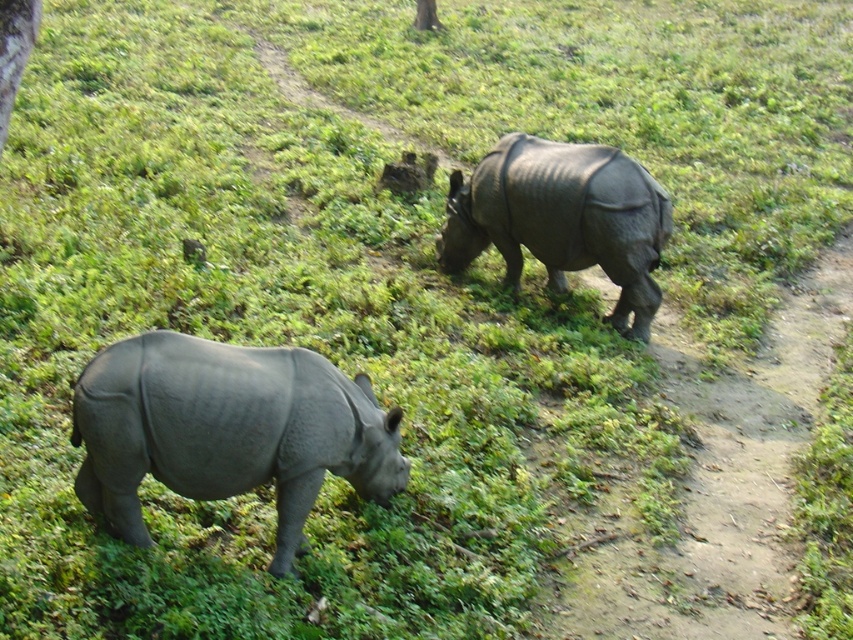
You are a wildlife photographer aiming to capture a photo of both rhinoceroses in the same frame. Given their positions, which direction should you move to ensure both the gray matte rhinoceros at lower left and the gray matte rhinoceros at upper right are visible in your camera viewfinder?

You should move to the center of the frame between the gray matte rhinoceros at lower left and the gray matte rhinoceros at upper right to ensure both are visible in the camera viewfinder since they are positioned to the left and right respectively.

You are a wildlife photographer trying to capture a photo of the gray matte rhinoceros at upper right. You are currently standing next to the gray matte rhinoceros at lower left. Which direction should you move to get a clear shot of the upper rhino?

The gray matte rhinoceros at upper right is above the gray matte rhinoceros at lower left, so you should move upward or to the right to get a clear shot of the gray matte rhinoceros at upper right.

You are standing in front of the two rhinoceroses in the savanna. You want to take a photo that includes both points marked as point [500,225] and point [0,108]. Which point should you focus on first to ensure both are in focus?

You should focus on point [0,108] first because it is closer to you than point [500,225], which is further away. This way, the depth of field will cover both points.